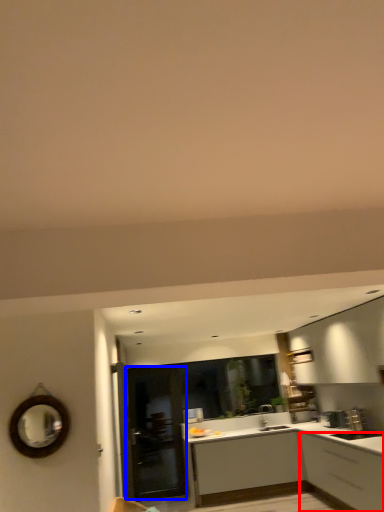
Question: Which object is further to the camera taking this photo, cabinetry (highlighted by a red box) or glass door (highlighted by a blue box)?

Choices:
 (A) cabinetry
 (B) glass door

Answer: (B)